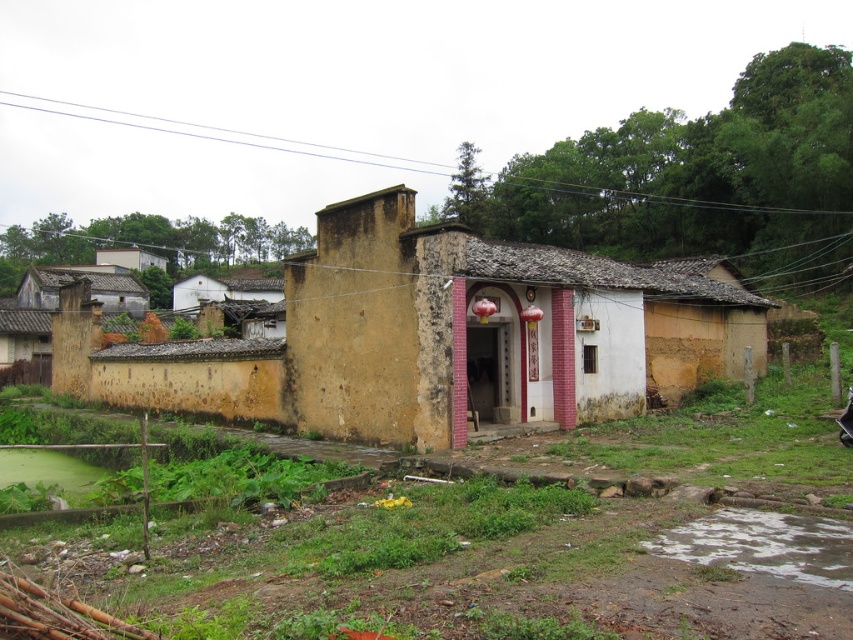
Question: In this image, where is yellow stucco house at center located relative to rusty metal hut at left?

Choices:
 (A) above
 (B) below

Answer: (B)

Question: Which point appears closest to the camera in this image?

Choices:
 (A) (433, 230)
 (B) (108, 298)

Answer: (A)

Question: Among these points, which one is nearest to the camera?

Choices:
 (A) (44, 353)
 (B) (57, 304)

Answer: (B)

Question: Is yellow stucco house at center positioned behind rusty metal hut at left?

Choices:
 (A) yes
 (B) no

Answer: (B)

Question: Is yellow stucco house at center smaller than rusty metal hut at left?

Choices:
 (A) yes
 (B) no

Answer: (A)